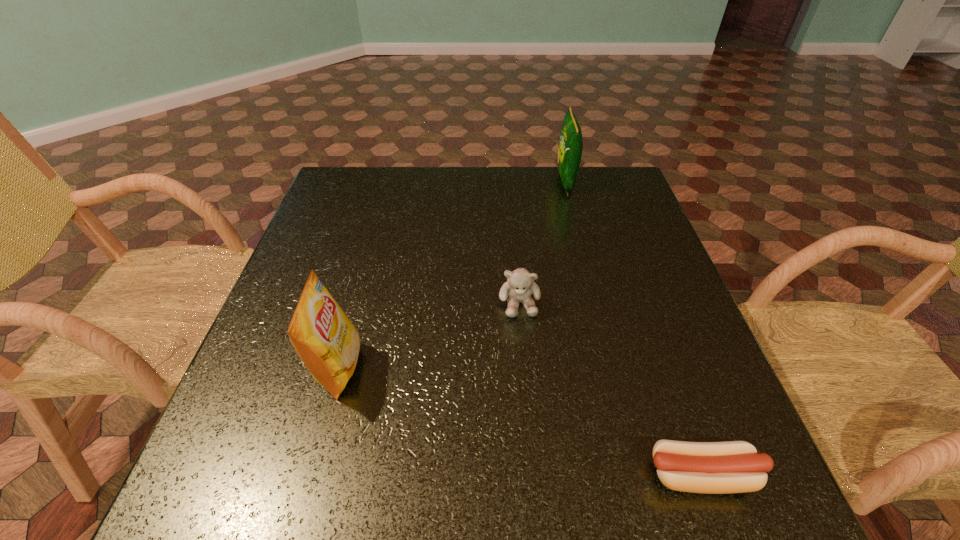
Image resolution: width=960 pixels, height=540 pixels. What are the coordinates of `blank space at the left edge of the desktop` in the screenshot? It's located at (297, 265).

In order to click on vacant area at the right edge of the desktop in this screenshot , I will do `click(639, 269)`.

In the image, there is a desktop. Where is `vacant space at the far left corner`? The width and height of the screenshot is (960, 540). vacant space at the far left corner is located at coordinates (360, 176).

Image resolution: width=960 pixels, height=540 pixels. Find the location of `vacant space at the near left corner of the desktop`. vacant space at the near left corner of the desktop is located at coordinates (252, 495).

Find the location of `vacant space at the far right corner of the desktop`. vacant space at the far right corner of the desktop is located at coordinates (582, 174).

Find the location of a particular element. This screenshot has height=540, width=960. free space at the near right corner is located at coordinates (767, 505).

Image resolution: width=960 pixels, height=540 pixels. Identify the location of free space between the second farthest object and the sausage. (611, 389).

The height and width of the screenshot is (540, 960). What are the coordinates of `free space that is in between the second nearest object and the sausage` in the screenshot? It's located at (520, 421).

Identify the location of vacant area between the farther crisp (potato chip) and the shortest object. The image size is (960, 540). (634, 328).

Where is `unoccupied position between the teddy bear and the nearer crisp (potato chip)`? Image resolution: width=960 pixels, height=540 pixels. unoccupied position between the teddy bear and the nearer crisp (potato chip) is located at coordinates (429, 335).